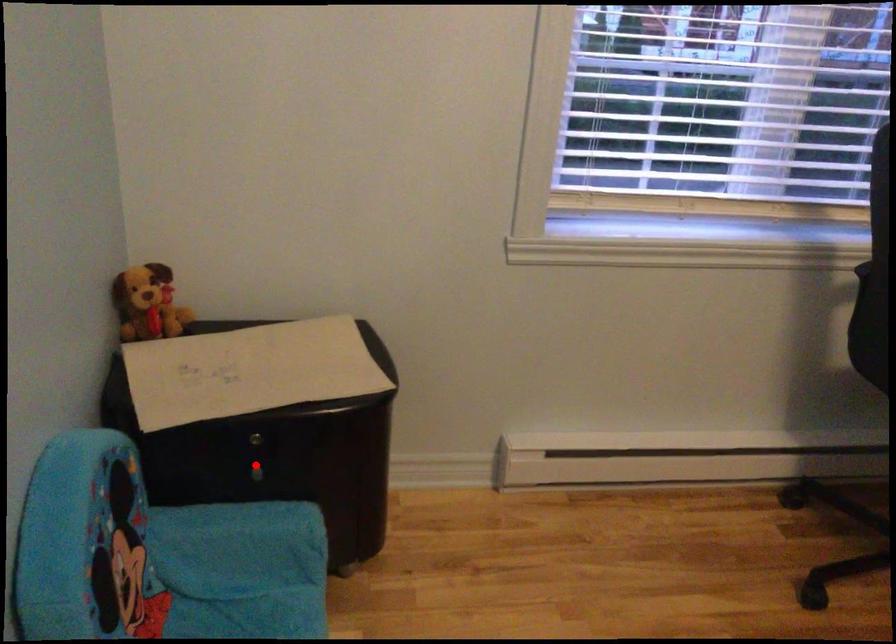
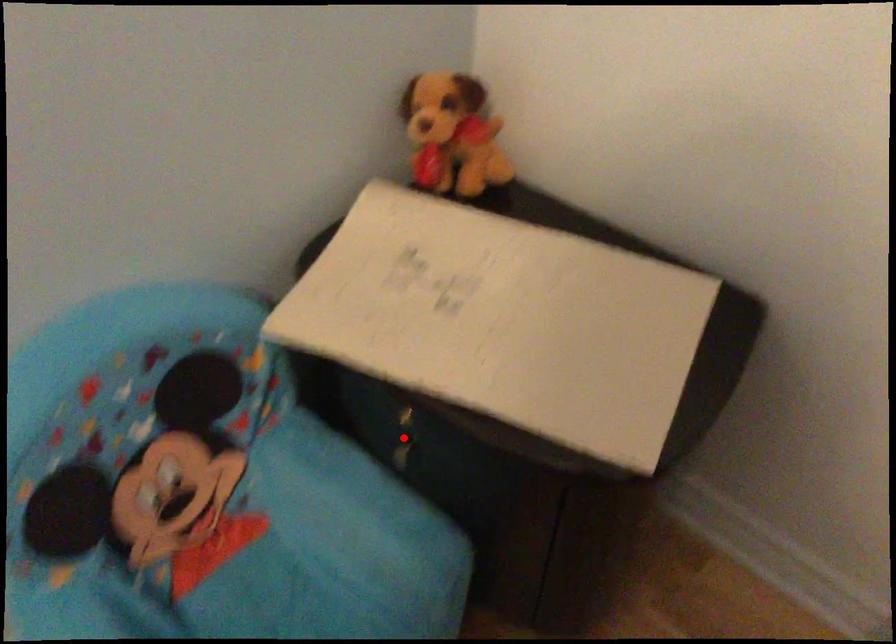
I am providing you with two images of the same scene from different viewpoints. A red point is marked on the first image and another point is marked on the second image. Does the point marked in image1 correspond to the same location as the one in image2?

Yes